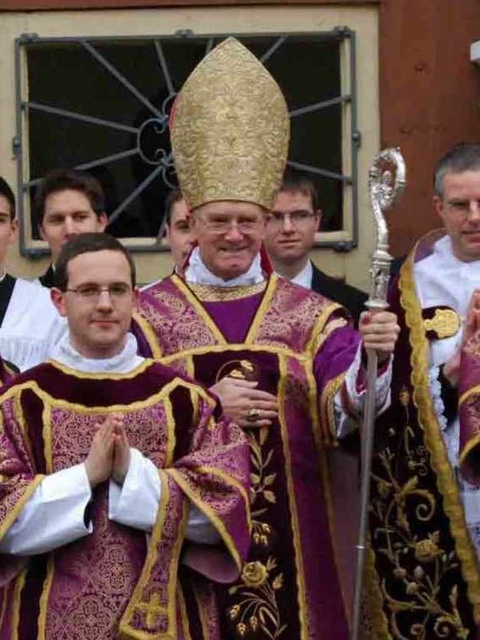
Who is more forward, [57,528] or [432,304]?

Point [57,528] is in front.

Image resolution: width=480 pixels, height=640 pixels. I want to click on purple embroidered robe at center, so click(x=117, y=502).

Between point (67, 468) and point (169, 323), which one is positioned in front?

Positioned in front is point (67, 468).

Is point (143, 438) positioned behind point (312, 586)?

No, (143, 438) is in front of (312, 586).

This screenshot has width=480, height=640. In order to click on purple embroidered robe at center in this screenshot , I will do `click(117, 502)`.

Is point (214, 636) in front of point (279, 218)?

Yes.

The width and height of the screenshot is (480, 640). What do you see at coordinates (117, 502) in the screenshot?
I see `purple embroidered robe at center` at bounding box center [117, 502].

Find the location of a particular element. purple embroidered robe at center is located at coordinates (117, 502).